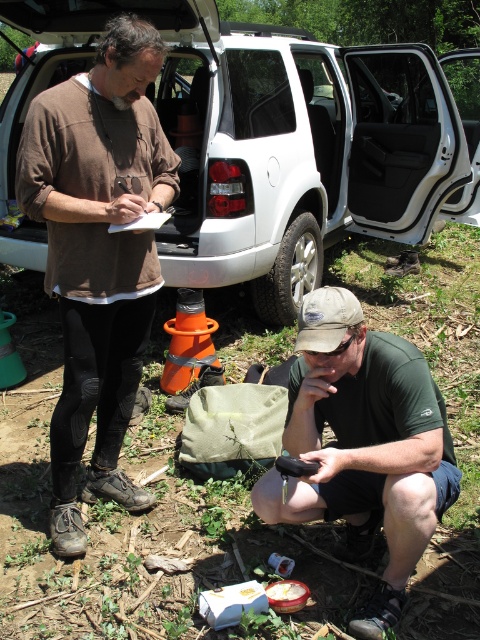
Question: Observing the image, what is the correct spatial positioning of brown matte shirt at upper left in reference to green fabric bag at lower center?

Choices:
 (A) below
 (B) above

Answer: (B)

Question: Which point is farther to the camera?

Choices:
 (A) green fabric bag at lower center
 (B) white matte suv at center
 (C) brown matte shirt at upper left

Answer: (B)

Question: Which object is the closest to the brown matte shirt at upper left?

Choices:
 (A) green fabric bag at lower center
 (B) white matte suv at center

Answer: (A)

Question: Does brown matte shirt at upper left lie behind green fabric bag at lower center?

Choices:
 (A) yes
 (B) no

Answer: (A)

Question: Which point is closer to the camera?

Choices:
 (A) (41, 45)
 (B) (313, 358)

Answer: (B)

Question: Is white matte suv at center closer to the viewer compared to green fabric bag at lower center?

Choices:
 (A) no
 (B) yes

Answer: (A)